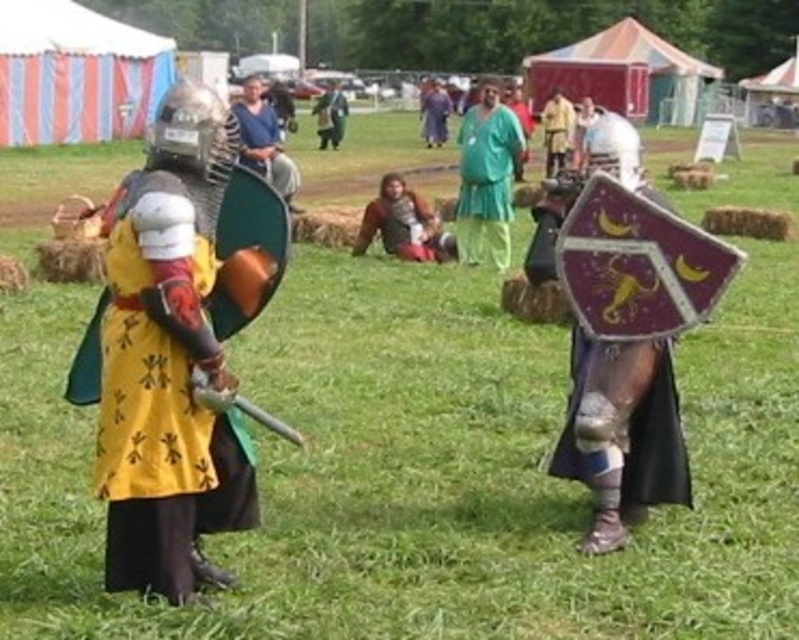
Question: Can you confirm if green fabric pants at center is thinner than matte blue tunic at center?

Choices:
 (A) no
 (B) yes

Answer: (A)

Question: Does yellow fabric tunic at center appear under matte blue tunic at center?

Choices:
 (A) yes
 (B) no

Answer: (A)

Question: Can you confirm if yellow fabric tunic at center is positioned to the right of matte blue tunic at center?

Choices:
 (A) yes
 (B) no

Answer: (A)

Question: Which point appears farthest from the camera in this image?

Choices:
 (A) (501, 140)
 (B) (260, 170)
 (C) (231, 440)
 (D) (448, 236)

Answer: (D)

Question: Which is farther from the brown leather armor at center?

Choices:
 (A) matte blue tunic at center
 (B) yellow fabric tunic at center
 (C) green fabric pants at center

Answer: (B)

Question: Which of the following is the farthest from the observer?

Choices:
 (A) (276, 188)
 (B) (428, 225)
 (C) (523, 140)
 (D) (126, 237)

Answer: (A)